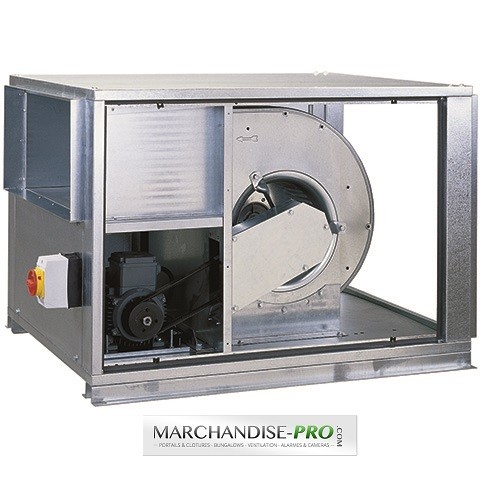
Where is `air vent`? Image resolution: width=480 pixels, height=480 pixels. air vent is located at coordinates (46, 160).